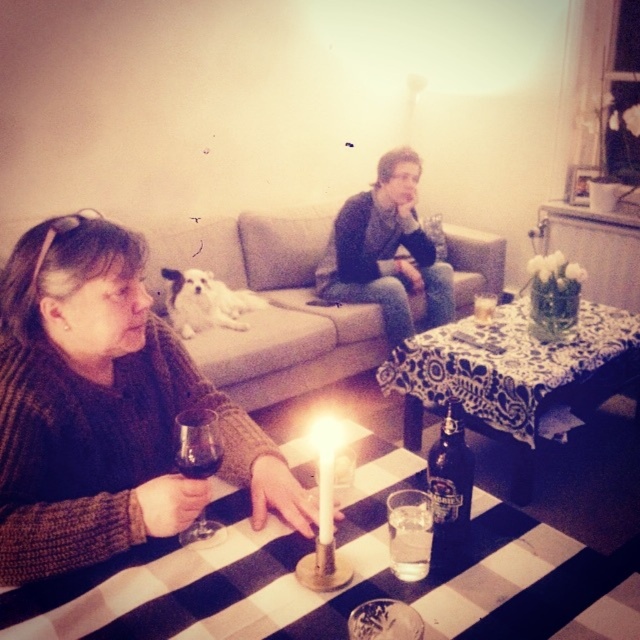
From the picture: You are a photographer trying to capture a candid shot of the dark blue sweater at center and the translucent glass bottle at center. Since the lighting is low, you need to adjust your camera settings. Which object should you focus on first to ensure proper exposure, considering their positions?

The dark blue sweater at center is above the translucent glass bottle at center, so you should focus on the dark blue sweater at center first as it is closer to the light source and might require more precise exposure.

You are planning to place a new coffee table in the living room. The coffee table must be placed between the gray fabric couch at center and the white fluffy dog at center. Considering their sizes, which object should the coffee table be closer to?

The gray fabric couch at center is larger in size than the white fluffy dog at center, so the coffee table should be placed closer to the smaller object, the white fluffy dog at center, to maintain balance in the room layout.

You are a guest entering the living room and want to sit down. The gray fabric couch at center and the white fluffy dog at center are both in the center. Which one is more likely to be available for you to sit on?

The gray fabric couch at center is positioned over white fluffy dog at center, meaning the couch is in front of the dog. Since the dog is likely occupying the space behind the couch, the couch itself is the available seating option.